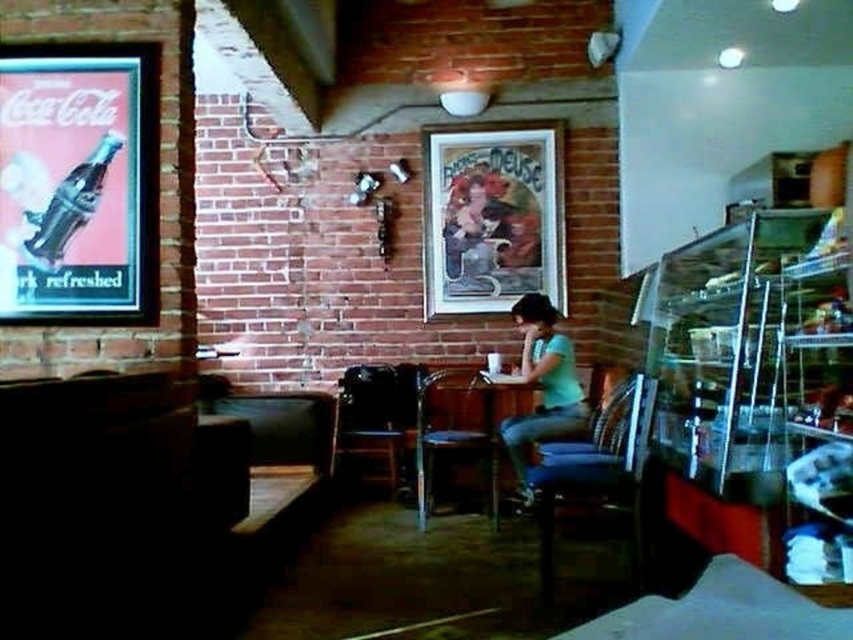
You are a customer entering the diner and see both the matte black chair at center and the metallic dark chair at center. If you want to choose the wider chair to sit on, which one should you pick?

The matte black chair at center is wider than the metallic dark chair at center, so you should pick the matte black chair at center.

You are a customer sitting at the wooden table at center in the diner. You want to pet the matte black cat at center. Can you reach it from your current position?

The wooden table at center is located below the matte black cat at center, so you can reach the matte black cat at center by extending your hand upwards from the wooden table at center.